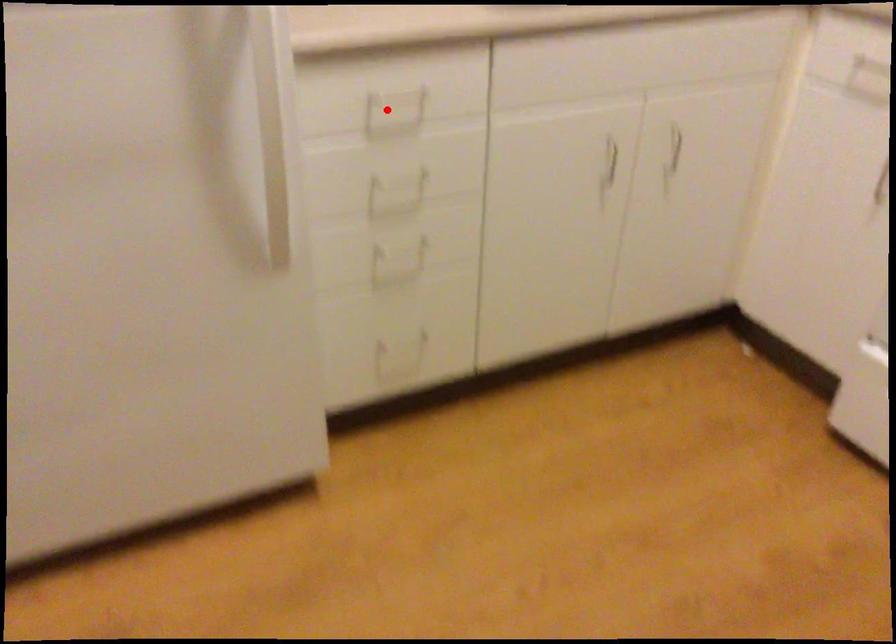
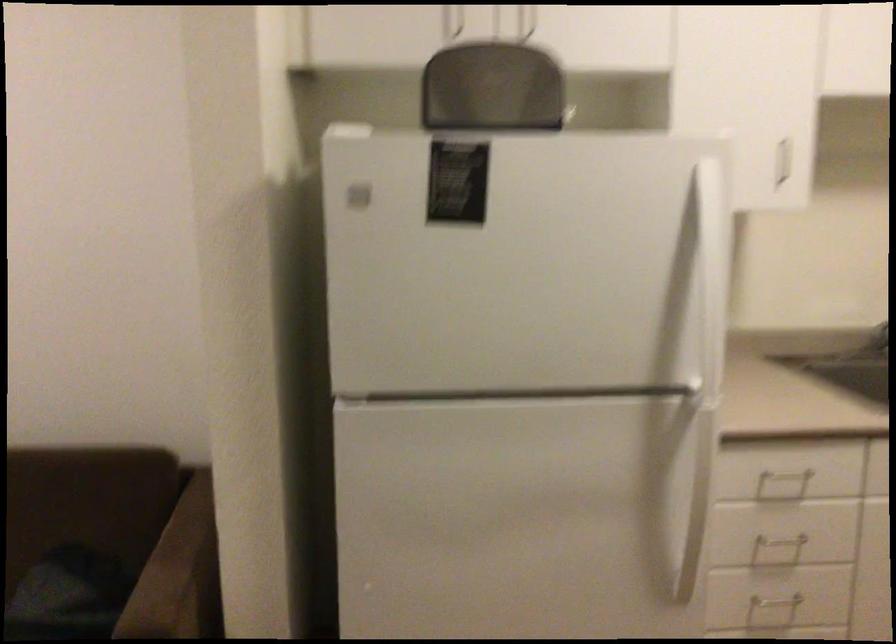
Question: I am providing you with two images of the same scene from different viewpoints. Image1 has a red point marked. In image2, the corresponding 3D location appears at what relative position? Reply with the corresponding letter.

Choices:
 (A) Closer
 (B) Farther

Answer: (B)